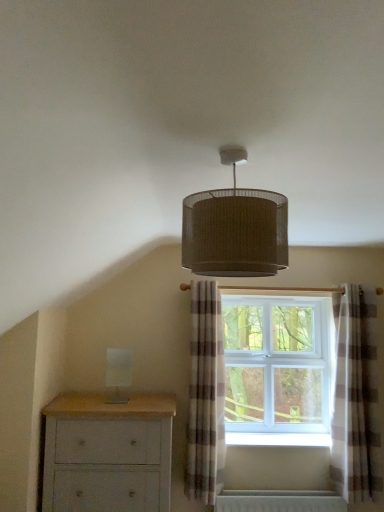
At what (x,y) coordinates should I click in order to perform the action: click on empty space that is ontop of white painted wood at lower center (from a real-world perspective). Please return your answer as a coordinate pair (x, y). This screenshot has width=384, height=512. Looking at the image, I should click on (291, 438).